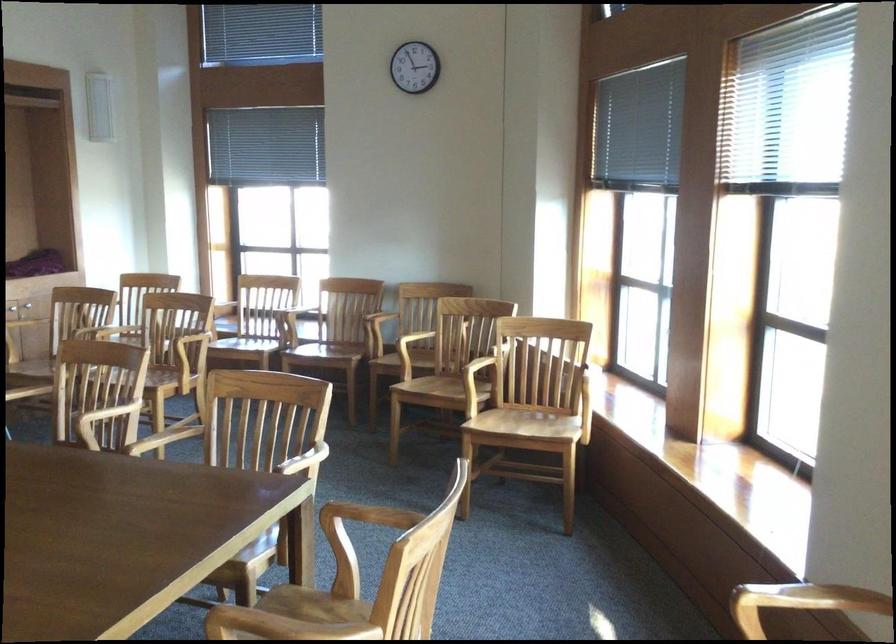
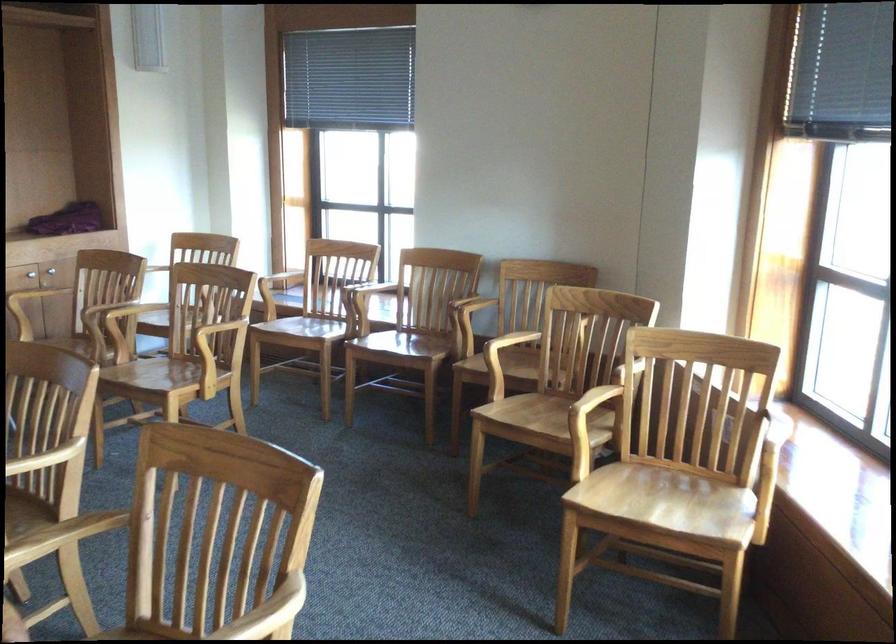
Question: The images are taken continuously from a first-person perspective. In which direction are you moving?

Choices:
 (A) Left
 (B) Right
 (C) Forward
 (D) Backward

Answer: (C)